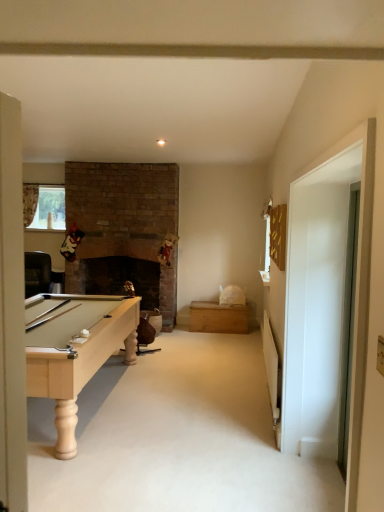
Question: Is clear glass window at upper left positioned with its back to white glossy door at right, placed as the first glass door when sorted from left to right?

Choices:
 (A) no
 (B) yes

Answer: (A)

Question: Does clear glass window at upper left lie in front of white glossy door at right, placed as the first glass door when sorted from left to right?

Choices:
 (A) no
 (B) yes

Answer: (A)

Question: Can you confirm if clear glass window at upper left is smaller than white glossy door at right, placed as the first glass door when sorted from left to right?

Choices:
 (A) yes
 (B) no

Answer: (A)

Question: Considering the relative sizes of clear glass window at upper left and white glossy door at right, the 2th glass door positioned from the right, in the image provided, is clear glass window at upper left shorter than white glossy door at right, the 2th glass door positioned from the right,?

Choices:
 (A) yes
 (B) no

Answer: (A)

Question: Can you confirm if clear glass window at upper left is wider than white glossy door at right, the 2th glass door positioned from the right?

Choices:
 (A) no
 (B) yes

Answer: (B)

Question: Is point (208, 306) positioned closer to the camera than point (56, 207)?

Choices:
 (A) farther
 (B) closer

Answer: (B)

Question: Would you say wooden chest at center is inside or outside clear glass window at upper left?

Choices:
 (A) outside
 (B) inside

Answer: (A)

Question: Relative to clear glass window at upper left, is wooden chest at center in front or behind?

Choices:
 (A) front
 (B) behind

Answer: (A)

Question: From a real-world perspective, is wooden chest at center physically located above or below clear glass window at upper left?

Choices:
 (A) below
 (B) above

Answer: (A)

Question: Considering the positions of clear glass window at upper left and white glossy door at right, placed as the first glass door when sorted from left to right, in the image, is clear glass window at upper left wider or thinner than white glossy door at right, placed as the first glass door when sorted from left to right,?

Choices:
 (A) wide
 (B) thin

Answer: (A)

Question: Is point (51, 226) closer or farther from the camera than point (291, 212)?

Choices:
 (A) closer
 (B) farther

Answer: (B)

Question: In terms of size, does clear glass window at upper left appear bigger or smaller than white glossy door at right, the 2th glass door positioned from the right?

Choices:
 (A) big
 (B) small

Answer: (B)

Question: From the image's perspective, is clear glass window at upper left located above or below white glossy door at right, placed as the first glass door when sorted from left to right?

Choices:
 (A) above
 (B) below

Answer: (A)

Question: Looking at the image, does clear glass window at upper left seem bigger or smaller compared to wooden chest at center?

Choices:
 (A) big
 (B) small

Answer: (B)

Question: Is clear glass window at upper left in front of or behind wooden chest at center in the image?

Choices:
 (A) front
 (B) behind

Answer: (B)